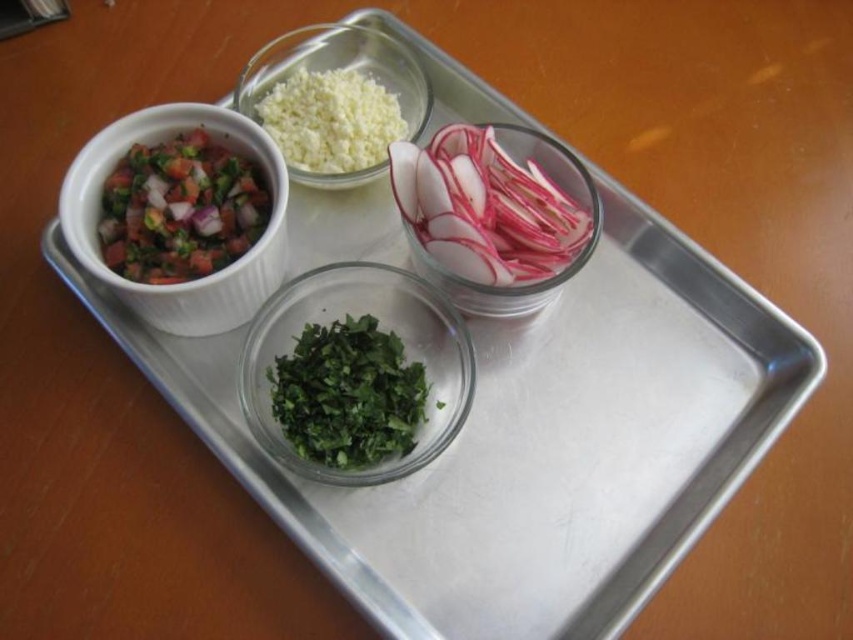
Which is more to the left, chopped tomato salad at upper left or white ribbed bowl at upper left?

From the viewer's perspective, chopped tomato salad at upper left appears more on the left side.

Is chopped tomato salad at upper left positioned in front of white ribbed bowl at upper left?

No.

What do you see at coordinates (181, 209) in the screenshot? I see `chopped tomato salad at upper left` at bounding box center [181, 209].

Find the location of a particular element. chopped tomato salad at upper left is located at coordinates (181, 209).

Consider the image. Is the position of chopped tomato salad at upper left less distant than that of white translucent bowl at upper center?

Yes, it is.

Describe the element at coordinates (181, 209) in the screenshot. The image size is (853, 640). I see `chopped tomato salad at upper left` at that location.

Locate an element on the screen. This screenshot has width=853, height=640. chopped tomato salad at upper left is located at coordinates (181, 209).

Consider the image. Who is positioned more to the left, pink translucent radish slices at upper right or white ribbed bowl at upper left?

white ribbed bowl at upper left is more to the left.

Is pink translucent radish slices at upper right to the right of white ribbed bowl at upper left from the viewer's perspective?

Yes, pink translucent radish slices at upper right is to the right of white ribbed bowl at upper left.

Which is in front, point (529, 150) or point (137, 134)?

Point (137, 134)

Find the location of a particular element. The width and height of the screenshot is (853, 640). pink translucent radish slices at upper right is located at coordinates (495, 216).